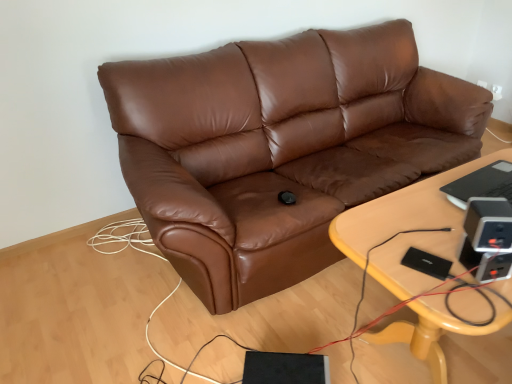
Question: Should I look upward or downward to see light wood/yellowishmaterial/texture table at center?

Choices:
 (A) up
 (B) down

Answer: (B)

Question: Is brown leather couch at center directly adjacent to light wood/yellowishmaterial/texture table at center?

Choices:
 (A) yes
 (B) no

Answer: (B)

Question: Does brown leather couch at center have a smaller size compared to light wood/yellowishmaterial/texture table at center?

Choices:
 (A) no
 (B) yes

Answer: (A)

Question: Does brown leather couch at center come behind light wood/yellowishmaterial/texture table at center?

Choices:
 (A) yes
 (B) no

Answer: (A)

Question: Considering the relative sizes of brown leather couch at center and light wood/yellowishmaterial/texture table at center in the image provided, is brown leather couch at center bigger than light wood/yellowishmaterial/texture table at center?

Choices:
 (A) no
 (B) yes

Answer: (B)

Question: Is brown leather couch at center not within light wood/yellowishmaterial/texture table at center?

Choices:
 (A) no
 (B) yes

Answer: (B)

Question: Is brown leather couch at center at the left side of light wood/yellowishmaterial/texture table at center?

Choices:
 (A) no
 (B) yes

Answer: (B)

Question: From the image's perspective, is light wood/yellowishmaterial/texture table at center over brown leather couch at center?

Choices:
 (A) yes
 (B) no

Answer: (B)

Question: Can you confirm if light wood/yellowishmaterial/texture table at center is positioned to the right of brown leather couch at center?

Choices:
 (A) no
 (B) yes

Answer: (B)

Question: Is light wood/yellowishmaterial/texture table at center closer to the viewer compared to brown leather couch at center?

Choices:
 (A) yes
 (B) no

Answer: (A)

Question: Can you confirm if light wood/yellowishmaterial/texture table at center is thinner than brown leather couch at center?

Choices:
 (A) yes
 (B) no

Answer: (A)

Question: Is light wood/yellowishmaterial/texture table at center shorter than brown leather couch at center?

Choices:
 (A) yes
 (B) no

Answer: (A)

Question: Can you confirm if light wood/yellowishmaterial/texture table at center is bigger than brown leather couch at center?

Choices:
 (A) no
 (B) yes

Answer: (A)

Question: Is light wood/yellowishmaterial/texture table at center bigger or smaller than brown leather couch at center?

Choices:
 (A) small
 (B) big

Answer: (A)